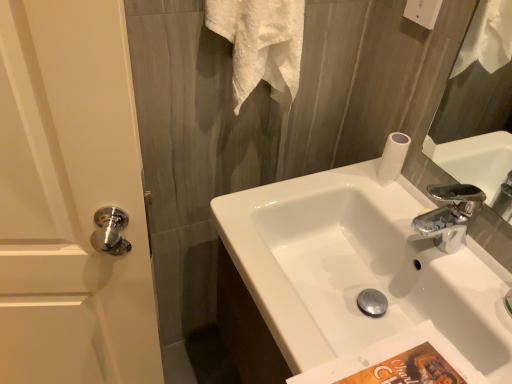
Describe the element at coordinates (261, 44) in the screenshot. I see `white textured towel at upper center` at that location.

In order to face white glossy sink at center, should I rotate leftwards or rightwards?

Rotate your view right by about 14.139°.

Locate an element on the screen. The width and height of the screenshot is (512, 384). white textured towel at upper center is located at coordinates (261, 44).

Looking at this image, could you tell me if white textured towel at upper center is turned towards white glossy door handle at left?

No.

Considering the points (257, 68) and (130, 122), which point is in front, point (257, 68) or point (130, 122)?

Positioned in front is point (130, 122).

The height and width of the screenshot is (384, 512). I want to click on screen door lying on the left of white textured towel at upper center, so click(x=70, y=199).

From a real-world perspective, who is located lower, white textured towel at upper center or white glossy door handle at left?

white glossy door handle at left.

Between white textured towel at upper center and white glossy sink at center, which one appears on the left side from the viewer's perspective?

white textured towel at upper center is more to the left.

In terms of height, does white textured towel at upper center look taller or shorter compared to white glossy sink at center?

Clearly, white textured towel at upper center is taller compared to white glossy sink at center.

Are white textured towel at upper center and white glossy sink at center far apart?

No, white textured towel at upper center is not far away from white glossy sink at center.

How much distance is there between white textured towel at upper center and white glossy sink at center?

white textured towel at upper center is 15.20 inches away from white glossy sink at center.

Considering the sizes of white glossy door handle at left and white textured towel at upper center in the image, is white glossy door handle at left taller or shorter than white textured towel at upper center?

Considering their sizes, white glossy door handle at left has more height than white textured towel at upper center.

From a real-world perspective, is white glossy door handle at left located higher than white textured towel at upper center?

No.

From a real-world perspective, between white glossy sink at center and white textured towel at upper center, who is vertically lower?

white glossy sink at center.

Is white glossy sink at center in front of or behind white textured towel at upper center in the image?

In the image, white glossy sink at center appears in front of white textured towel at upper center.

How many degrees apart are the facing directions of white glossy sink at center and white textured towel at upper center?

The angle between the facing direction of white glossy sink at center and the facing direction of white textured towel at upper center is 91.1 degrees.

Can you confirm if white glossy sink at center is taller than white textured towel at upper center?

Incorrect, the height of white glossy sink at center is not larger of that of white textured towel at upper center.

Between white glossy door handle at left and white glossy sink at center, which one appears on the right side from the viewer's perspective?

white glossy sink at center is more to the right.

From a real-world perspective, between white glossy door handle at left and white glossy sink at center, who is vertically lower?

white glossy door handle at left.

Considering the sizes of objects white glossy door handle at left and white glossy sink at center in the image provided, who is thinner, white glossy door handle at left or white glossy sink at center?

Thinner between the two is white glossy door handle at left.

The height and width of the screenshot is (384, 512). In order to click on sink that is on the right side of white glossy door handle at left in this screenshot , I will do point(358,269).

Is point (438, 323) closer or farther from the camera than point (88, 166)?

Point (438, 323) is positioned farther from the camera compared to point (88, 166).

Does white glossy sink at center turn towards white glossy door handle at left?

No, white glossy sink at center is not oriented towards white glossy door handle at left.

Between white glossy sink at center and white glossy door handle at left, which one has less height?

white glossy sink at center is shorter.

This screenshot has height=384, width=512. I want to click on screen door below the white glossy sink at center (from a real-world perspective), so (x=70, y=199).

Locate an element on the screen. Image resolution: width=512 pixels, height=384 pixels. screen door lying on the left of white textured towel at upper center is located at coordinates (70, 199).

The image size is (512, 384). In the image, there is a white textured towel at upper center. Find the location of `sink below it (from the image's perspective)`. sink below it (from the image's perspective) is located at coordinates (358, 269).

When comparing their distances from white textured towel at upper center, does white glossy door handle at left or white glossy sink at center seem closer?

white glossy sink at center is closer to white textured towel at upper center.

Consider the image. Looking at the image, which one is located further to white glossy door handle at left, white textured towel at upper center or white glossy sink at center?

white textured towel at upper center is further to white glossy door handle at left.

Looking at the image, which one is located further to white glossy sink at center, white textured towel at upper center or white glossy door handle at left?

The object further to white glossy sink at center is white glossy door handle at left.

Estimate the real-world distances between objects in this image. Which object is closer to white textured towel at upper center, white glossy sink at center or white glossy door handle at left?

white glossy sink at center.

Based on their spatial positions, is white glossy door handle at left or white textured towel at upper center further from white glossy sink at center?

Based on the image, white glossy door handle at left appears to be further to white glossy sink at center.

Looking at the image, which one is located further to white glossy door handle at left, white glossy sink at center or white textured towel at upper center?

The object further to white glossy door handle at left is white textured towel at upper center.

This screenshot has height=384, width=512. Identify the location of bath towel between white glossy door handle at left and white glossy sink at center from left to right. (x=261, y=44).